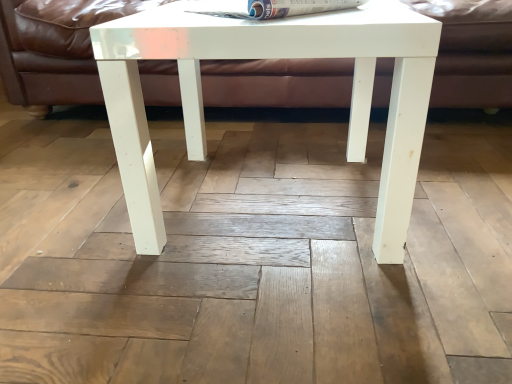
The width and height of the screenshot is (512, 384). What do you see at coordinates (270, 57) in the screenshot? I see `white glossy table at center` at bounding box center [270, 57].

This screenshot has width=512, height=384. In order to click on matte brown leather couch at upper center in this screenshot , I will do `click(53, 49)`.

What's the angular difference between white glossy table at center and white glossy magazine at upper center's facing directions?

There is a 46.6-degree angle between the facing directions of white glossy table at center and white glossy magazine at upper center.

Which point is more distant from viewer, (x=149, y=160) or (x=280, y=15)?

The point (x=149, y=160) is behind.

From the picture: Considering the sizes of objects white glossy table at center and white glossy magazine at upper center in the image provided, who is smaller, white glossy table at center or white glossy magazine at upper center?

Smaller between the two is white glossy magazine at upper center.

Considering the sizes of objects white glossy table at center and white glossy magazine at upper center in the image provided, who is shorter, white glossy table at center or white glossy magazine at upper center?

white glossy magazine at upper center.

Would you say matte brown leather couch at upper center is part of white glossy table at center's contents?

No, white glossy table at center does not contain matte brown leather couch at upper center.

Measure the distance from white glossy table at center to matte brown leather couch at upper center.

A distance of 19.69 inches exists between white glossy table at center and matte brown leather couch at upper center.

Is white glossy table at center not close to matte brown leather couch at upper center?

No, white glossy table at center is not far away from matte brown leather couch at upper center.

From the image's perspective, does white glossy table at center appear lower than matte brown leather couch at upper center?

Indeed, from the image's perspective, white glossy table at center is shown beneath matte brown leather couch at upper center.

Is white glossy magazine at upper center next to white glossy table at center and touching it?

There is a gap between white glossy magazine at upper center and white glossy table at center.

Considering the relative sizes of white glossy magazine at upper center and white glossy table at center in the image provided, is white glossy magazine at upper center smaller than white glossy table at center?

Correct, white glossy magazine at upper center occupies less space than white glossy table at center.

Is white glossy magazine at upper center spatially inside white glossy table at center, or outside of it?

white glossy magazine at upper center cannot be found inside white glossy table at center.

How much distance is there between white glossy magazine at upper center and white glossy table at center?

white glossy magazine at upper center and white glossy table at center are 9.01 inches apart.

From a real-world perspective, is matte brown leather couch at upper center on white glossy table at center?

Indeed, from a real-world perspective, matte brown leather couch at upper center stands above white glossy table at center.

Would you consider matte brown leather couch at upper center to be distant from white glossy table at center?

No, there isn't a large distance between matte brown leather couch at upper center and white glossy table at center.

Can you confirm if matte brown leather couch at upper center is taller than white glossy table at center?

Correct, matte brown leather couch at upper center is much taller as white glossy table at center.

From the image's perspective, is matte brown leather couch at upper center over white glossy table at center?

Yes.

Is matte brown leather couch at upper center aimed at white glossy magazine at upper center?

Yes.

Considering the sizes of objects matte brown leather couch at upper center and white glossy magazine at upper center in the image provided, who is taller, matte brown leather couch at upper center or white glossy magazine at upper center?

Standing taller between the two is matte brown leather couch at upper center.

Find the location of a particular element. couch above the white glossy magazine at upper center (from the image's perspective) is located at coordinates (53, 49).

Can you confirm if matte brown leather couch at upper center is wider than white glossy magazine at upper center?

Yes, matte brown leather couch at upper center is wider than white glossy magazine at upper center.

Would you consider white glossy magazine at upper center to be distant from matte brown leather couch at upper center?

No, white glossy magazine at upper center is not far from matte brown leather couch at upper center.

The image size is (512, 384). In order to click on couch that is above the white glossy magazine at upper center (from the image's perspective) in this screenshot , I will do `click(53, 49)`.

Considering the sizes of white glossy magazine at upper center and matte brown leather couch at upper center in the image, is white glossy magazine at upper center wider or thinner than matte brown leather couch at upper center?

white glossy magazine at upper center is thinner than matte brown leather couch at upper center.

I want to click on table in front of the white glossy magazine at upper center, so click(x=270, y=57).

Image resolution: width=512 pixels, height=384 pixels. I want to click on couch lying behind the white glossy table at center, so click(53, 49).

Based on their spatial positions, is white glossy magazine at upper center or matte brown leather couch at upper center closer to white glossy table at center?

Among the two, white glossy magazine at upper center is located nearer to white glossy table at center.

Looking at the image, which one is located further to white glossy magazine at upper center, matte brown leather couch at upper center or white glossy table at center?

matte brown leather couch at upper center lies further to white glossy magazine at upper center than the other object.

Consider the image. When comparing their distances from white glossy magazine at upper center, does white glossy table at center or matte brown leather couch at upper center seem further?

Based on the image, matte brown leather couch at upper center appears to be further to white glossy magazine at upper center.

Looking at the image, which one is located further to white glossy table at center, matte brown leather couch at upper center or white glossy magazine at upper center?

matte brown leather couch at upper center is positioned further to the anchor white glossy table at center.

Which object lies nearer to the anchor point matte brown leather couch at upper center, white glossy magazine at upper center or white glossy table at center?

Based on the image, white glossy table at center appears to be nearer to matte brown leather couch at upper center.

Looking at the image, which one is located further to matte brown leather couch at upper center, white glossy table at center or white glossy magazine at upper center?

Based on the image, white glossy magazine at upper center appears to be further to matte brown leather couch at upper center.

Where is `magazine positioned between white glossy table at center and matte brown leather couch at upper center from near to far`? magazine positioned between white glossy table at center and matte brown leather couch at upper center from near to far is located at coordinates (284, 8).